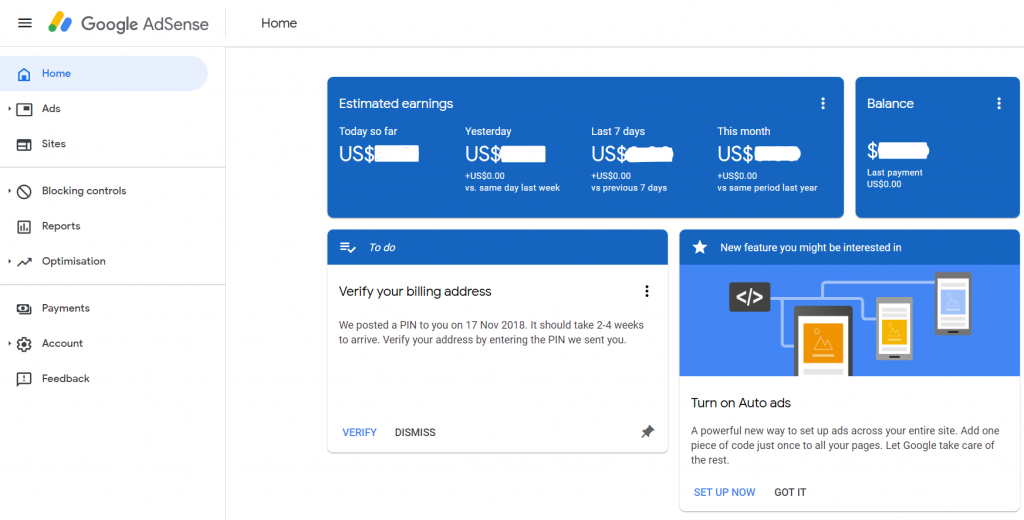
Locate an element on the screen. This screenshot has width=1024, height=520. slanted grey pushpin is located at coordinates click(646, 434).